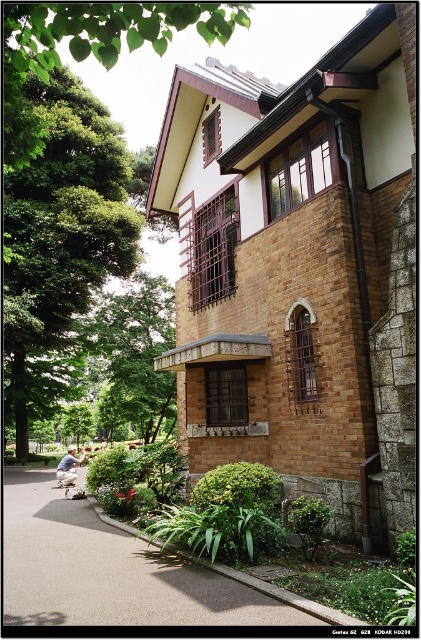
Question: Among these points, which one is farthest from the camera?

Choices:
 (A) (109, 170)
 (B) (191, 573)
 (C) (109, 294)
 (D) (261, 340)

Answer: (C)

Question: Does green leafy tree at center appear on the left side of stone textured balcony at center?

Choices:
 (A) no
 (B) yes

Answer: (B)

Question: Which of the following is the farthest from the observer?

Choices:
 (A) (127, 340)
 (B) (15, 234)
 (C) (8, 17)
 (D) (154, 358)

Answer: (A)

Question: Does smooth asphalt path at lower left have a greater width compared to green leafy tree at upper left?

Choices:
 (A) no
 (B) yes

Answer: (A)

Question: Which object is positioned farthest from the stone textured balcony at center?

Choices:
 (A) green leafy tree at center
 (B) smooth asphalt path at lower left
 (C) green leafy tree at upper left

Answer: (A)

Question: Does green leafy tree at left lie behind green leafy tree at upper left?

Choices:
 (A) yes
 (B) no

Answer: (A)